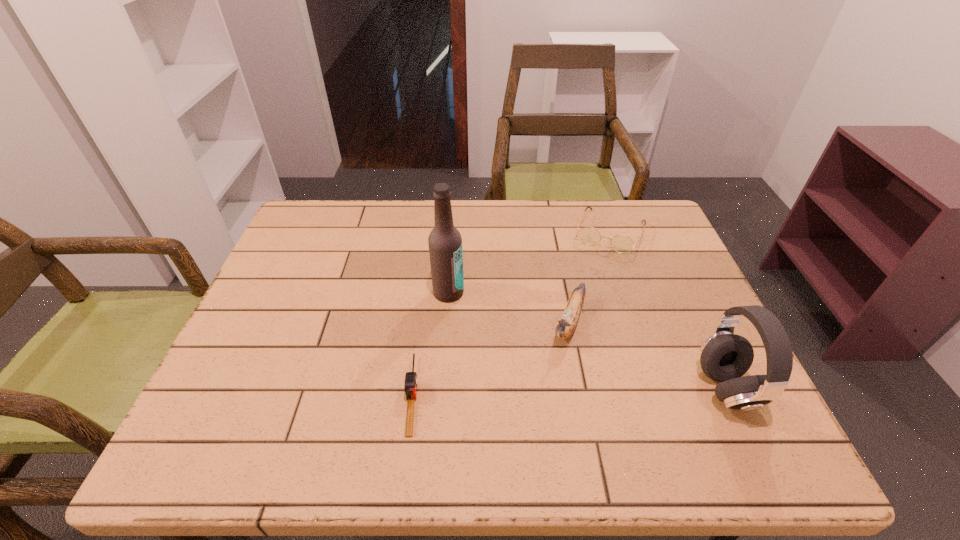
In order to click on tape measure situated at the near edge in this screenshot , I will do `click(410, 386)`.

The image size is (960, 540). Identify the location of headset that is at the near edge. (724, 357).

Find the location of `headset present at the right edge`. headset present at the right edge is located at coordinates (x=724, y=357).

The height and width of the screenshot is (540, 960). What are the coordinates of `spectacles located in the right edge section of the desktop` in the screenshot? It's located at (589, 235).

Find the location of a particular element. The image size is (960, 540). object at the far right corner is located at coordinates (589, 235).

Locate an element on the screen. object that is at the near right corner is located at coordinates (724, 357).

Locate an element on the screen. vacant space at the far edge is located at coordinates (546, 223).

In the image, there is a desktop. Where is `free space at the near edge`? The width and height of the screenshot is (960, 540). free space at the near edge is located at coordinates (591, 405).

Where is `vacant space at the left edge`? The height and width of the screenshot is (540, 960). vacant space at the left edge is located at coordinates (240, 356).

Locate an element on the screen. free region at the right edge is located at coordinates (664, 370).